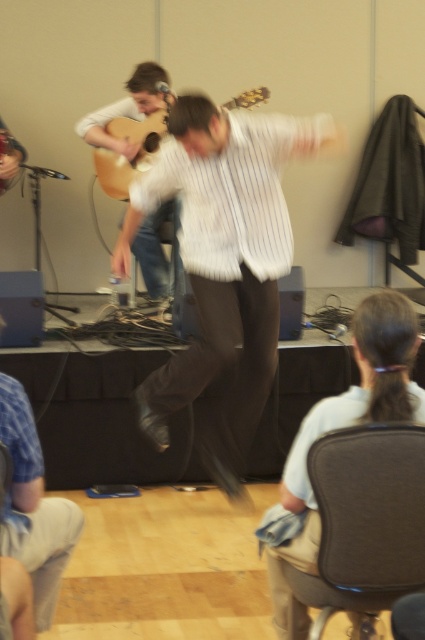
Which is more to the left, blue denim shorts at lower left or acoustic wood guitar at center?

Positioned to the left is acoustic wood guitar at center.

Based on the photo, does blue denim shorts at lower left come in front of acoustic wood guitar at center?

Yes.

Is point (42, 502) positioned behind point (133, 120)?

No.

This screenshot has height=640, width=425. In order to click on blue denim shorts at lower left in this screenshot , I will do `click(34, 506)`.

Is white striped shirt at center thinner than acoustic wood guitar at center?

In fact, white striped shirt at center might be wider than acoustic wood guitar at center.

Between white striped shirt at center and acoustic wood guitar at center, which one is positioned higher?

acoustic wood guitar at center is higher up.

Image resolution: width=425 pixels, height=640 pixels. I want to click on white striped shirt at center, so click(x=223, y=266).

From the picture: Who is shorter, black fabric chair at lower right or blue denim shorts at lower left?

With less height is black fabric chair at lower right.

How far apart are black fabric chair at lower right and blue denim shorts at lower left?

A distance of 3.50 feet exists between black fabric chair at lower right and blue denim shorts at lower left.

Locate an element on the screen. The image size is (425, 640). black fabric chair at lower right is located at coordinates (363, 522).